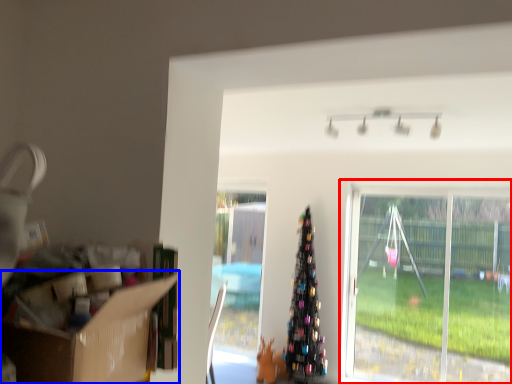
Question: Which object appears closest to the camera in this image, window (highlighted by a red box) or cardboard box (highlighted by a blue box)?

Choices:
 (A) window
 (B) cardboard box

Answer: (B)